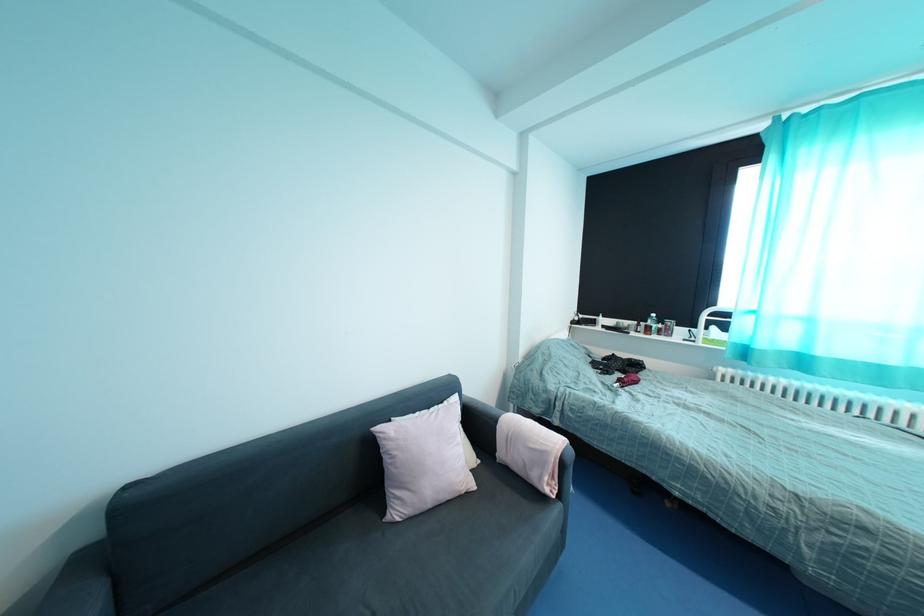
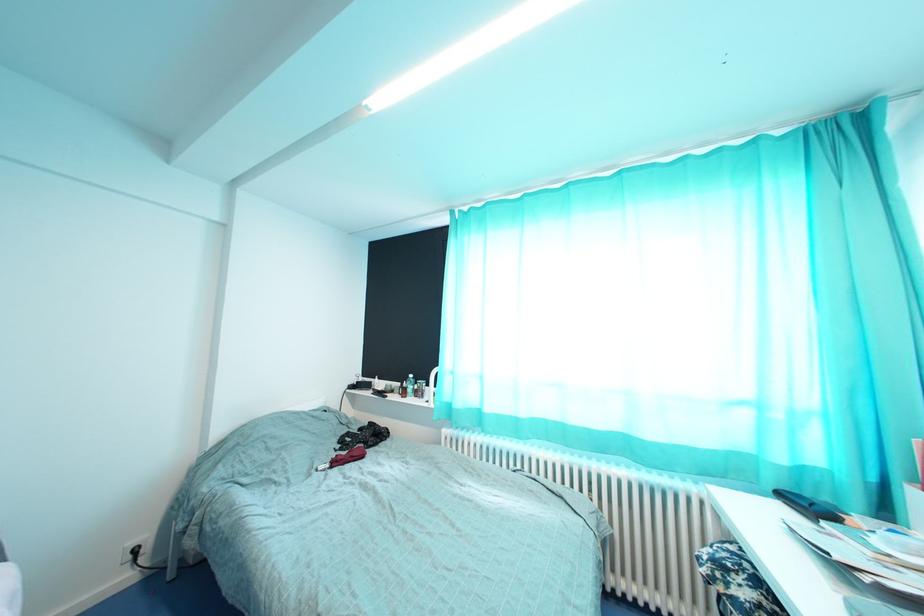
Question: Which direction would the cameraman need to move to produce the second image? Reply with the corresponding letter.

Choices:
 (A) Left
 (B) Right
 (C) Forward
 (D) Backward

Answer: (B)